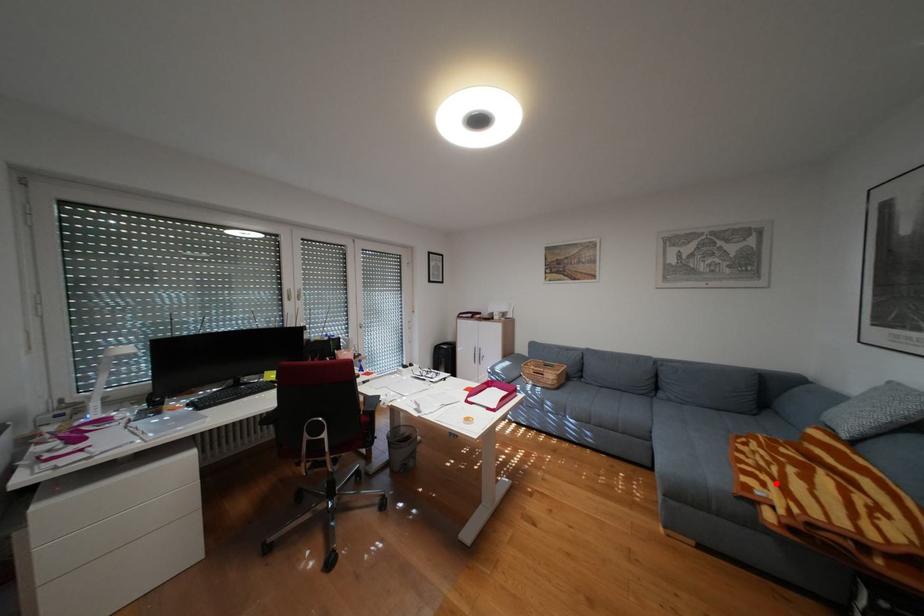
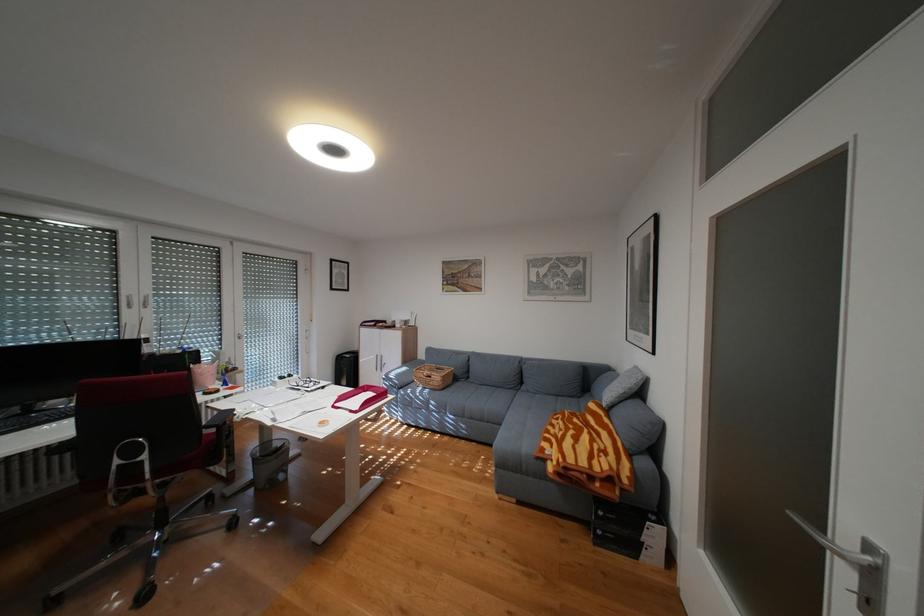
Find the pixel in the second image that matches the highlighted location in the first image.

(564, 445)